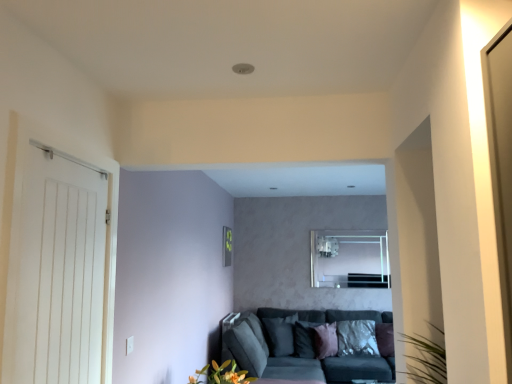
Question: Is pink velvet pillow at center, placed as the 3th pillow when sorted from right to left, taller than white wooden door at left?

Choices:
 (A) yes
 (B) no

Answer: (B)

Question: Is pink velvet pillow at center, placed as the 3th pillow when sorted from right to left, facing towards white wooden door at left?

Choices:
 (A) yes
 (B) no

Answer: (B)

Question: Is pink velvet pillow at center, placed as the 3th pillow when sorted from right to left, oriented away from white wooden door at left?

Choices:
 (A) no
 (B) yes

Answer: (A)

Question: Would you say pink velvet pillow at center, arranged as the fourth pillow when viewed from the left, contains white wooden door at left?

Choices:
 (A) yes
 (B) no

Answer: (B)

Question: Does pink velvet pillow at center, arranged as the fourth pillow when viewed from the left, have a lesser width compared to white wooden door at left?

Choices:
 (A) yes
 (B) no

Answer: (B)

Question: Visually, is velvet dark grey couch at lower center positioned to the left or to the right of purple velvet pillow at lower right, marked as the first pillow in a right-to-left arrangement?

Choices:
 (A) left
 (B) right

Answer: (A)

Question: From a real-world perspective, relative to purple velvet pillow at lower right, marked as the first pillow in a right-to-left arrangement, is velvet dark grey couch at lower center vertically above or below?

Choices:
 (A) above
 (B) below

Answer: (B)

Question: Is velvet dark grey couch at lower center in front of or behind purple velvet pillow at lower right, positioned as the 6th pillow in left-to-right order, in the image?

Choices:
 (A) front
 (B) behind

Answer: (A)

Question: Is point (249, 354) closer or farther from the camera than point (377, 344)?

Choices:
 (A) farther
 (B) closer

Answer: (B)

Question: From their relative heights in the image, would you say pink velvet pillow at center, placed as the 3th pillow when sorted from right to left, is taller or shorter than velvet dark grey couch at lower center?

Choices:
 (A) tall
 (B) short

Answer: (B)

Question: In the image, is pink velvet pillow at center, placed as the 3th pillow when sorted from right to left, positioned in front of or behind velvet dark grey couch at lower center?

Choices:
 (A) front
 (B) behind

Answer: (B)

Question: Considering the positions of pink velvet pillow at center, arranged as the fourth pillow when viewed from the left, and velvet dark grey couch at lower center in the image, is pink velvet pillow at center, arranged as the fourth pillow when viewed from the left, bigger or smaller than velvet dark grey couch at lower center?

Choices:
 (A) big
 (B) small

Answer: (B)

Question: From a real-world perspective, is pink velvet pillow at center, arranged as the fourth pillow when viewed from the left, above or below velvet dark grey couch at lower center?

Choices:
 (A) below
 (B) above

Answer: (B)

Question: From the image's perspective, is white wooden door at left located above or below silky purple pillow at center, acting as the fourth pillow starting from the right?

Choices:
 (A) below
 (B) above

Answer: (B)

Question: Is white wooden door at left taller or shorter than silky purple pillow at center, arranged as the third pillow when viewed from the left?

Choices:
 (A) short
 (B) tall

Answer: (B)